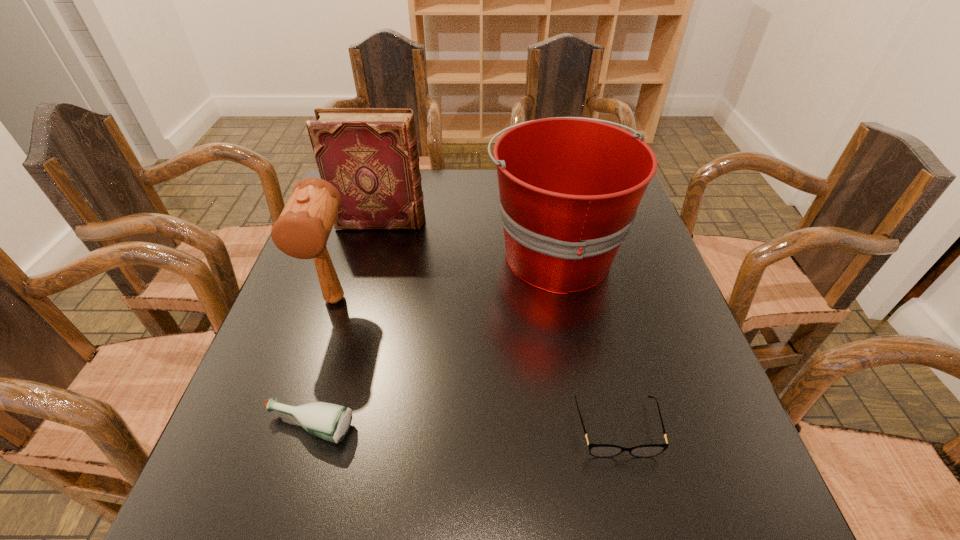
Where is `vacant position at the near right corner of the desktop`? Image resolution: width=960 pixels, height=540 pixels. vacant position at the near right corner of the desktop is located at coordinates (680, 493).

Where is `empty space that is in between the spectacles and the bucket`? Image resolution: width=960 pixels, height=540 pixels. empty space that is in between the spectacles and the bucket is located at coordinates (586, 341).

Image resolution: width=960 pixels, height=540 pixels. In order to click on vacant area between the spectacles and the mallet in this screenshot , I will do `click(476, 364)`.

I want to click on empty location between the mallet and the bucket, so click(445, 276).

The width and height of the screenshot is (960, 540). What are the coordinates of `vacant area that lies between the bucket and the shortest object` in the screenshot? It's located at (586, 341).

You are a GUI agent. You are given a task and a screenshot of the screen. Output one action in this format:
    pyautogui.click(x=<x>, y=<y>)
    Task: Click on the vacant area between the mallet and the shortest object
    
    Given the screenshot: What is the action you would take?
    pos(476,364)

Where is `free space between the spectacles and the mallet`? The height and width of the screenshot is (540, 960). free space between the spectacles and the mallet is located at coordinates click(476, 364).

At what (x,y) coordinates should I click in order to perform the action: click on free space that is in between the shortest object and the hardback book. Please return your answer as a coordinate pair (x, y). This screenshot has height=540, width=960. Looking at the image, I should click on (499, 325).

Where is `empty location between the shortest object and the mallet`? empty location between the shortest object and the mallet is located at coordinates (476, 364).

I want to click on vacant space that's between the hardback book and the second shortest object, so click(346, 325).